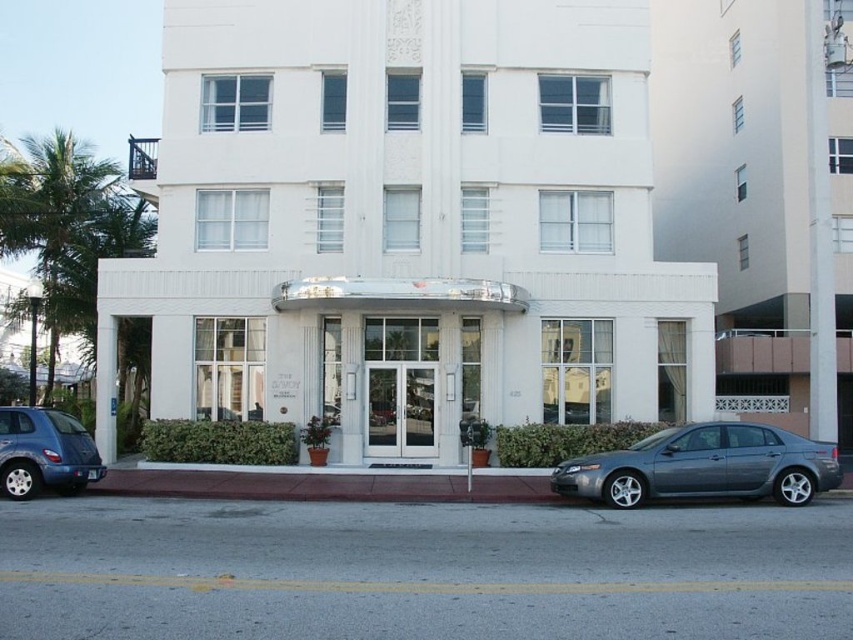
Consider the image. Who is taller, white smooth building at center or red brick sidewalk at center?

With more height is white smooth building at center.

Does point (616, 122) come closer to viewer compared to point (508, 484)?

No, it is not.

Where is `white smooth building at center`? Image resolution: width=853 pixels, height=640 pixels. white smooth building at center is located at coordinates coord(405,220).

Can you confirm if white smooth building at right is bigger than matte blue suv at lower left?

Yes, white smooth building at right is bigger than matte blue suv at lower left.

Does point (798, 412) come farther from viewer compared to point (80, 465)?

Yes, point (798, 412) is farther from viewer.

This screenshot has height=640, width=853. Describe the element at coordinates (738, 188) in the screenshot. I see `white smooth building at right` at that location.

Locate an element on the screen. white smooth building at right is located at coordinates tap(738, 188).

Is the position of matte blue suv at lower left less distant than that of white glass doors at center?

Yes.

The width and height of the screenshot is (853, 640). What are the coordinates of `matte blue suv at lower left` in the screenshot? It's located at (44, 452).

Locate an element on the screen. matte blue suv at lower left is located at coordinates [44, 452].

Locate an element on the screen. The image size is (853, 640). matte blue suv at lower left is located at coordinates (44, 452).